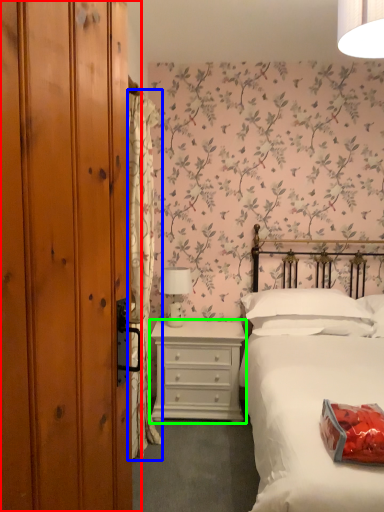
Question: Considering the real-world distances, which object is farthest from dresser (highlighted by a red box)? curtain (highlighted by a blue box) or chest of drawers (highlighted by a green box)?

Choices:
 (A) curtain
 (B) chest of drawers

Answer: (B)